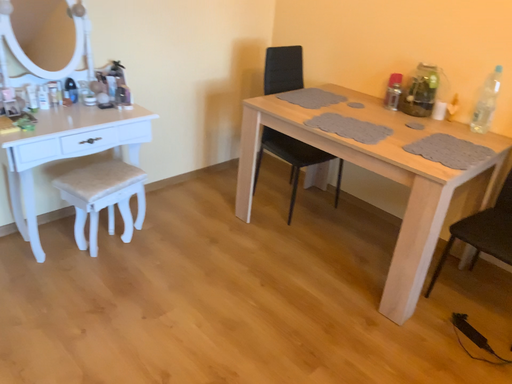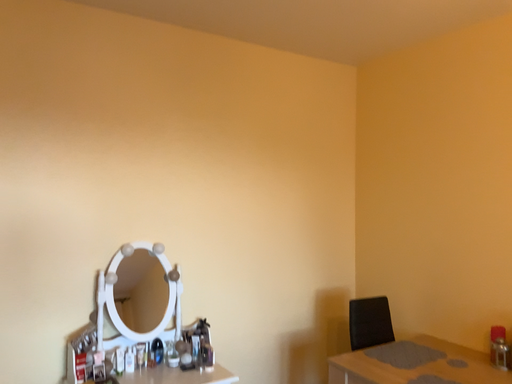
Question: How did the camera likely rotate when shooting the video?

Choices:
 (A) rotated upward
 (B) rotated downward

Answer: (A)